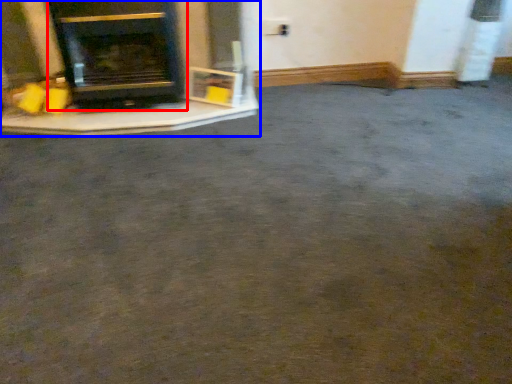
Question: Which object is further to the camera taking this photo, wood burning stove (highlighted by a red box) or fireplace (highlighted by a blue box)?

Choices:
 (A) wood burning stove
 (B) fireplace

Answer: (B)